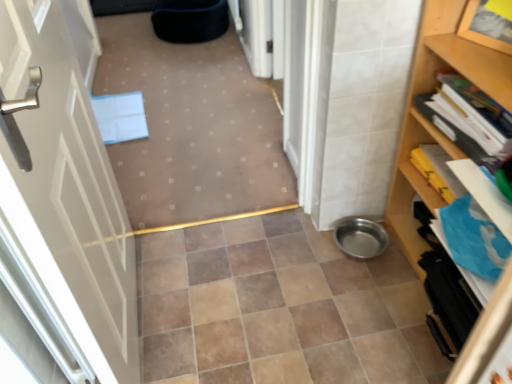
Question: From the image's perspective, does white glossy door at left appear lower than wooden bookshelf at right?

Choices:
 (A) no
 (B) yes

Answer: (B)

Question: Is white glossy door at left to the right of wooden bookshelf at right from the viewer's perspective?

Choices:
 (A) yes
 (B) no

Answer: (B)

Question: Considering the relative sizes of white glossy door at left and wooden bookshelf at right in the image provided, is white glossy door at left wider than wooden bookshelf at right?

Choices:
 (A) yes
 (B) no

Answer: (B)

Question: Is wooden bookshelf at right at the back of white glossy door at left?

Choices:
 (A) yes
 (B) no

Answer: (B)

Question: Considering the relative sizes of white glossy door at left and wooden bookshelf at right in the image provided, is white glossy door at left thinner than wooden bookshelf at right?

Choices:
 (A) yes
 (B) no

Answer: (A)

Question: Does white glossy door at left have a smaller size compared to wooden bookshelf at right?

Choices:
 (A) yes
 (B) no

Answer: (A)

Question: From the image's perspective, does wooden bookshelf at right appear higher than white glossy door at left?

Choices:
 (A) no
 (B) yes

Answer: (B)

Question: From a real-world perspective, is wooden bookshelf at right positioned over white glossy door at left based on gravity?

Choices:
 (A) no
 (B) yes

Answer: (A)

Question: Is wooden bookshelf at right facing away from white glossy door at left?

Choices:
 (A) yes
 (B) no

Answer: (B)

Question: Can you confirm if wooden bookshelf at right is shorter than white glossy door at left?

Choices:
 (A) yes
 (B) no

Answer: (A)

Question: Is wooden bookshelf at right thinner than white glossy door at left?

Choices:
 (A) yes
 (B) no

Answer: (B)

Question: Could you tell me if wooden bookshelf at right is turned towards white glossy door at left?

Choices:
 (A) no
 (B) yes

Answer: (B)

Question: Could you tell me if brown ceramic tile at center is facing matte blue folder at center?

Choices:
 (A) yes
 (B) no

Answer: (B)